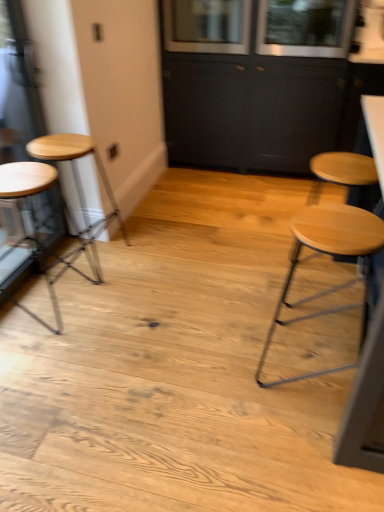
Question: Does light wood stool at right, which appears as the first stool when viewed from the right, have a lesser height compared to wooden stool at left, acting as the 1th stool starting from the left?

Choices:
 (A) yes
 (B) no

Answer: (B)

Question: Is light wood stool at right, which appears as the 3th stool when viewed from the left, placed right next to wooden stool at left, acting as the 1th stool starting from the left?

Choices:
 (A) no
 (B) yes

Answer: (A)

Question: Is light wood stool at right, which appears as the first stool when viewed from the right, at the left side of wooden stool at left, the third stool in the right-to-left sequence?

Choices:
 (A) no
 (B) yes

Answer: (A)

Question: Considering the relative sizes of light wood stool at right, which appears as the first stool when viewed from the right, and wooden stool at left, acting as the 1th stool starting from the left, in the image provided, is light wood stool at right, which appears as the first stool when viewed from the right, bigger than wooden stool at left, acting as the 1th stool starting from the left,?

Choices:
 (A) yes
 (B) no

Answer: (A)

Question: Does light wood stool at right, which appears as the 3th stool when viewed from the left, have a greater height compared to wooden stool at left, the third stool in the right-to-left sequence?

Choices:
 (A) no
 (B) yes

Answer: (B)

Question: Considering the relative positions of light wood stool at right, which appears as the first stool when viewed from the right, and clear glass window at upper center, arranged as the second window when viewed from the right, in the image provided, is light wood stool at right, which appears as the first stool when viewed from the right, to the left or to the right of clear glass window at upper center, arranged as the second window when viewed from the right,?

Choices:
 (A) left
 (B) right

Answer: (B)

Question: From a real-world perspective, is light wood stool at right, which appears as the 3th stool when viewed from the left, positioned above or below clear glass window at upper center, arranged as the second window when viewed from the right?

Choices:
 (A) below
 (B) above

Answer: (A)

Question: Is light wood stool at right, which appears as the first stool when viewed from the right, inside or outside of clear glass window at upper center, which is the 1th window in left-to-right order?

Choices:
 (A) outside
 (B) inside

Answer: (A)

Question: Considering the positions of light wood stool at right, which appears as the first stool when viewed from the right, and clear glass window at upper center, arranged as the second window when viewed from the right, in the image, is light wood stool at right, which appears as the first stool when viewed from the right, wider or thinner than clear glass window at upper center, arranged as the second window when viewed from the right,?

Choices:
 (A) thin
 (B) wide

Answer: (A)

Question: Based on their sizes in the image, would you say wooden stool at left, the third stool in the right-to-left sequence, is bigger or smaller than light brown wood stool at left, placed as the second stool when sorted from right to left?

Choices:
 (A) big
 (B) small

Answer: (A)

Question: From the image's perspective, relative to light brown wood stool at left, which appears as the second stool when viewed from the left, is wooden stool at left, acting as the 1th stool starting from the left, above or below?

Choices:
 (A) below
 (B) above

Answer: (A)

Question: From a real-world perspective, is wooden stool at left, the third stool in the right-to-left sequence, physically located above or below light brown wood stool at left, which appears as the second stool when viewed from the left?

Choices:
 (A) above
 (B) below

Answer: (B)

Question: From their relative heights in the image, would you say wooden stool at left, acting as the 1th stool starting from the left, is taller or shorter than light brown wood stool at left, placed as the second stool when sorted from right to left?

Choices:
 (A) short
 (B) tall

Answer: (B)

Question: Is clear glass window at upper center, placed as the 2th window when sorted from left to right, wider or thinner than wooden stool at left, the third stool in the right-to-left sequence?

Choices:
 (A) wide
 (B) thin

Answer: (A)

Question: Is clear glass window at upper center, placed as the 2th window when sorted from left to right, bigger or smaller than wooden stool at left, acting as the 1th stool starting from the left?

Choices:
 (A) big
 (B) small

Answer: (A)